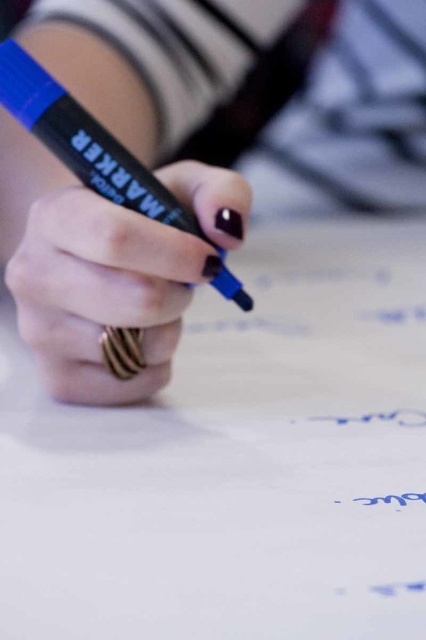
Is point (100, 291) positioned in front of point (224, 179)?

Yes, it is in front of point (224, 179).

Does blue marker at center have a greater height compared to matte black marker at center?

Yes.

Which is behind, point (100, 330) or point (31, 170)?

Positioned behind is point (31, 170).

Where is `blue marker at center`? blue marker at center is located at coordinates click(88, 275).